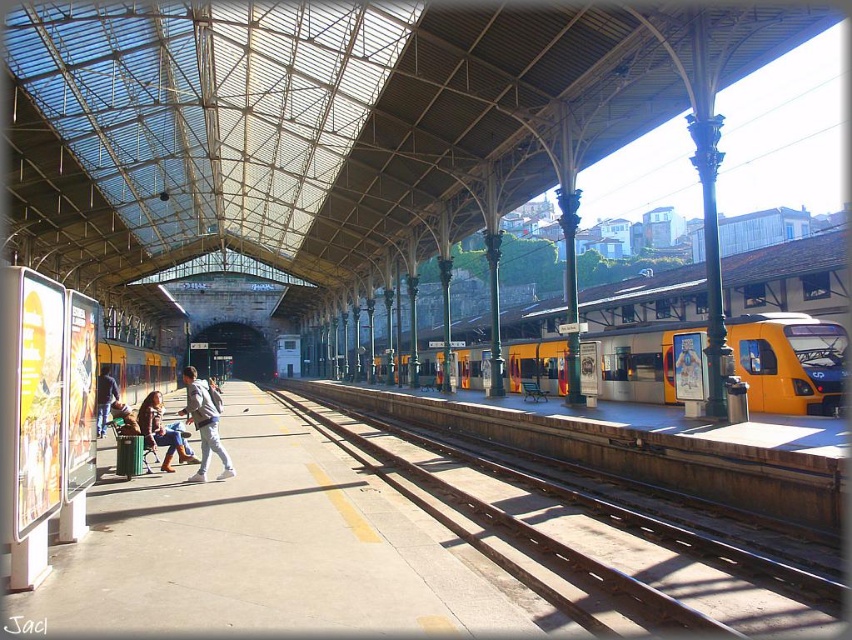
Is point (171, 470) more distant than point (113, 381)?

No, (171, 470) is in front of (113, 381).

Who is shorter, denim jacket at lower left or denim jacket at center?

Standing shorter between the two is denim jacket at lower left.

Which is behind, point (165, 433) or point (101, 420)?

Point (101, 420)

Identify the location of denim jacket at lower left. click(x=160, y=432).

Is the position of light gray fabric jacket at center less distant than that of light brown leather jacket at center?

Yes, it is in front of light brown leather jacket at center.

Is light gray fabric jacket at center further to camera compared to light brown leather jacket at center?

No, it is not.

Which is in front, point (196, 381) or point (675, 378)?

Point (196, 381) is more forward.

Identify the location of light gray fabric jacket at center. (204, 422).

Is metal/smooth track at center bigger than yellow metallic train at center?

Incorrect, metal/smooth track at center is not larger than yellow metallic train at center.

The image size is (852, 640). In order to click on metal/smooth track at center in this screenshot , I will do `click(590, 540)`.

Who is more forward, (464,534) or (671,365)?

Point (464,534) is in front.

Identify the location of metal/smooth track at center. [x=590, y=540].